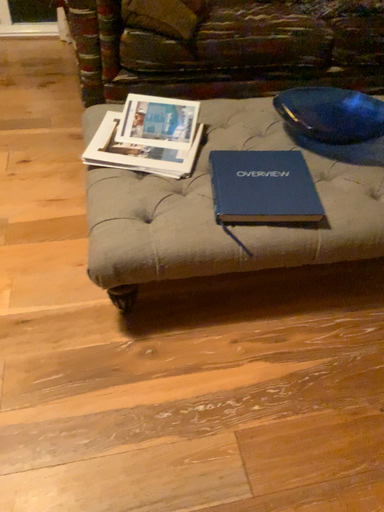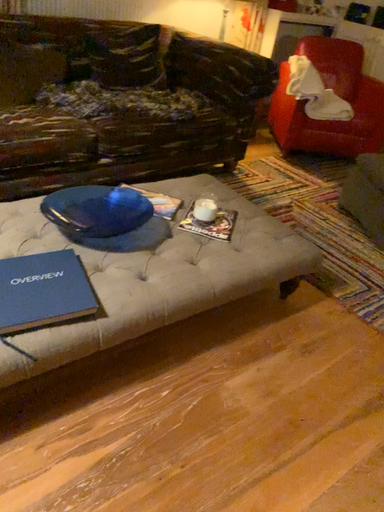
Question: How did the camera likely rotate when shooting the video?

Choices:
 (A) rotated upward
 (B) rotated downward

Answer: (A)